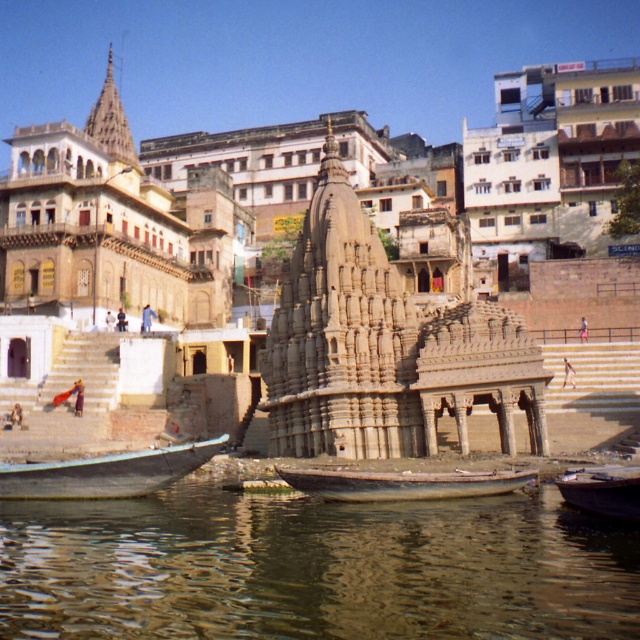
Consider the image. You are standing at the riverbank and want to reach the temple structure. There are two points marked on the path. Which point should you go through first, point (272, 342) or point (192, 458)?

You should go through point (192, 458) first because point (272, 342) is behind it.

You are standing on the riverside and want to board a boat. Which boat would require you to climb higher to get on board, the blue wooden boat at lower left or the wooden boat at center?

The blue wooden boat at lower left has a greater height compared to the wooden boat at center, so you would need to climb higher to board the blue wooden boat at lower left.

You are standing at the riverside and want to reach a specific point marked at coordinates point [44,248]. If your current position is 100 feet away from the temple structure, can you estimate whether the point is closer or farther than your current position?

The distance of point [44,248] from viewer is 327.70 feet, which is farther than your current position of 100 feet away from the temple structure.